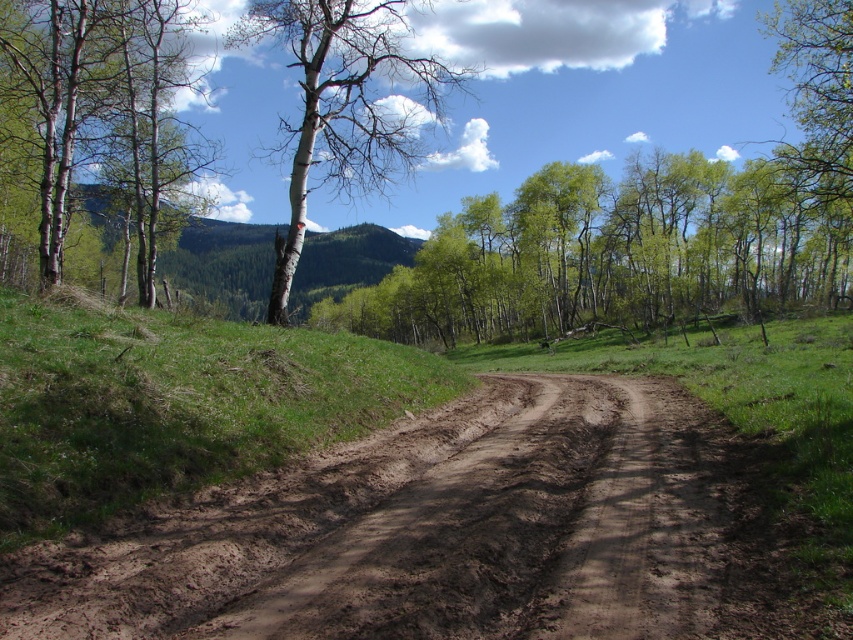
Question: Which point is closer to the camera taking this photo?

Choices:
 (A) (636, 323)
 (B) (189, 74)

Answer: (A)

Question: Can you confirm if white bark tree at upper center is bigger than green leafy tree at upper right?

Choices:
 (A) no
 (B) yes

Answer: (A)

Question: Can you confirm if brown muddy road at center is positioned to the right of white bark tree at upper center?

Choices:
 (A) yes
 (B) no

Answer: (A)

Question: Which object is positioned farthest from the brown muddy road at center?

Choices:
 (A) green leafy tree at upper right
 (B) white bark tree at upper center
 (C) green grassy hillside at left
 (D) smooth white tree at left

Answer: (B)

Question: Estimate the real-world distances between objects in this image. Which object is closer to the smooth white tree at left?

Choices:
 (A) white bark tree at upper center
 (B) green grassy hillside at left

Answer: (B)

Question: Is the position of green leafy tree at center more distant than that of smooth white tree at left?

Choices:
 (A) no
 (B) yes

Answer: (B)